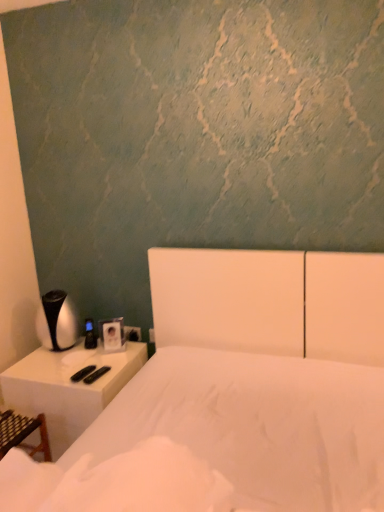
Question: Looking at their shapes, would you say white plastic nightstand at left is wider or thinner than white matte bed at center?

Choices:
 (A) thin
 (B) wide

Answer: (A)

Question: Looking at the image, does white plastic nightstand at left seem bigger or smaller compared to white matte bed at center?

Choices:
 (A) small
 (B) big

Answer: (A)

Question: Which object is the farthest from the white matte bed at center?

Choices:
 (A) white plastic electric outlet at lower center
 (B) white plastic nightstand at left

Answer: (A)

Question: Estimate the real-world distances between objects in this image. Which object is closer to the white plastic nightstand at left?

Choices:
 (A) white plastic electric outlet at lower center
 (B) white matte bed at center

Answer: (A)